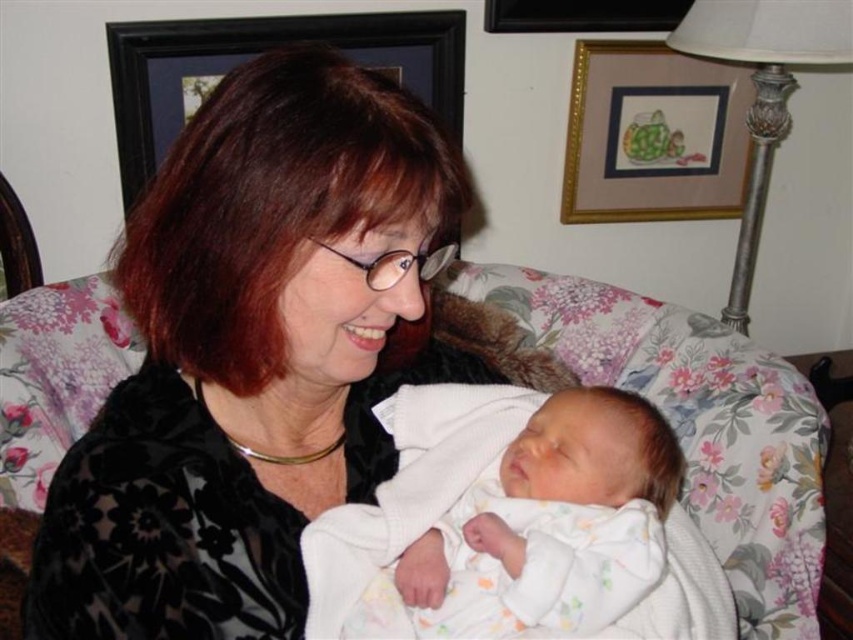
Question: Which of the following is the farthest from the observer?

Choices:
 (A) black wooden picture frame at upper center
 (B) matte black blouse at center

Answer: (A)

Question: Can you confirm if white soft fabric newborn at center is positioned to the right of wooden picture frame at upper center?

Choices:
 (A) no
 (B) yes

Answer: (A)

Question: Does wooden picture frame at upper center appear under black wooden picture frame at upper center?

Choices:
 (A) no
 (B) yes

Answer: (B)

Question: Among these points, which one is farthest from the camera?

Choices:
 (A) (183, 35)
 (B) (532, 17)
 (C) (310, 168)

Answer: (B)

Question: Among these points, which one is nearest to the camera?

Choices:
 (A) (106, 524)
 (B) (189, 86)
 (C) (532, 497)

Answer: (A)

Question: Does black framed picture at upper center appear under black wooden picture frame at upper center?

Choices:
 (A) yes
 (B) no

Answer: (A)